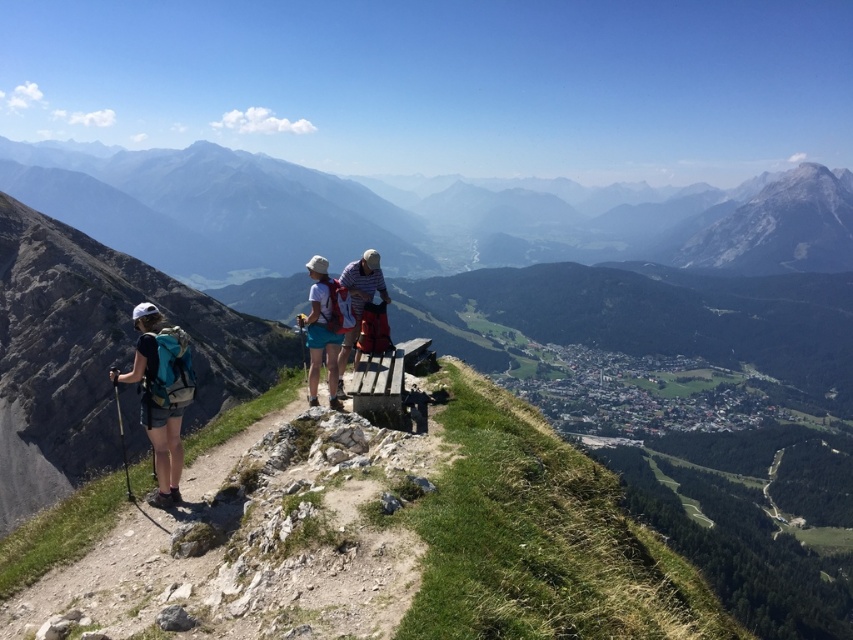
You are a hiker standing at the edge of the cliff on the dirt path. You see the rocky mountain at center and the striped cotton shirt at center. Which object is higher from your perspective?

The rocky mountain at center is positioned over the striped cotton shirt at center, so it is higher from your perspective.